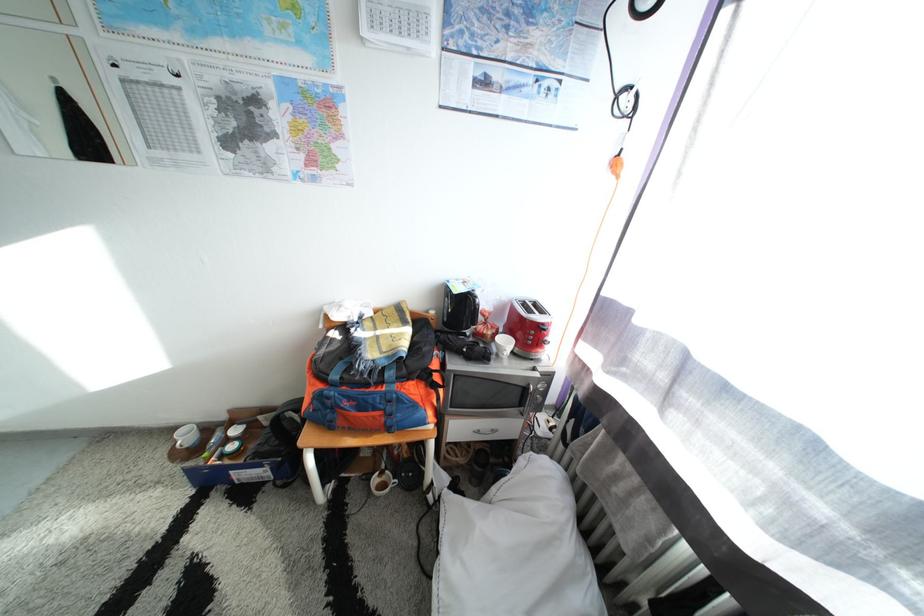
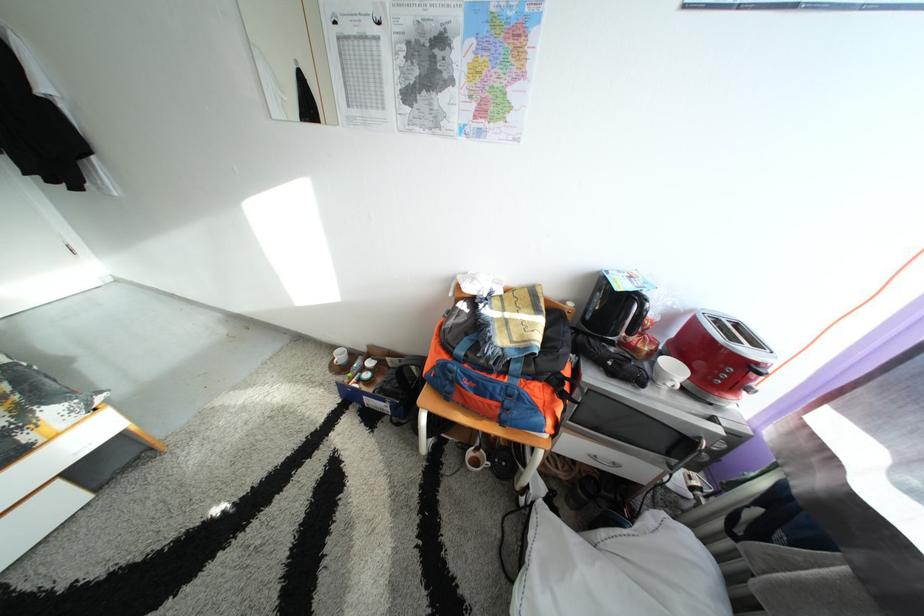
Where in the second image is the point corresponding to point 515,349 from the first image?

(683, 376)